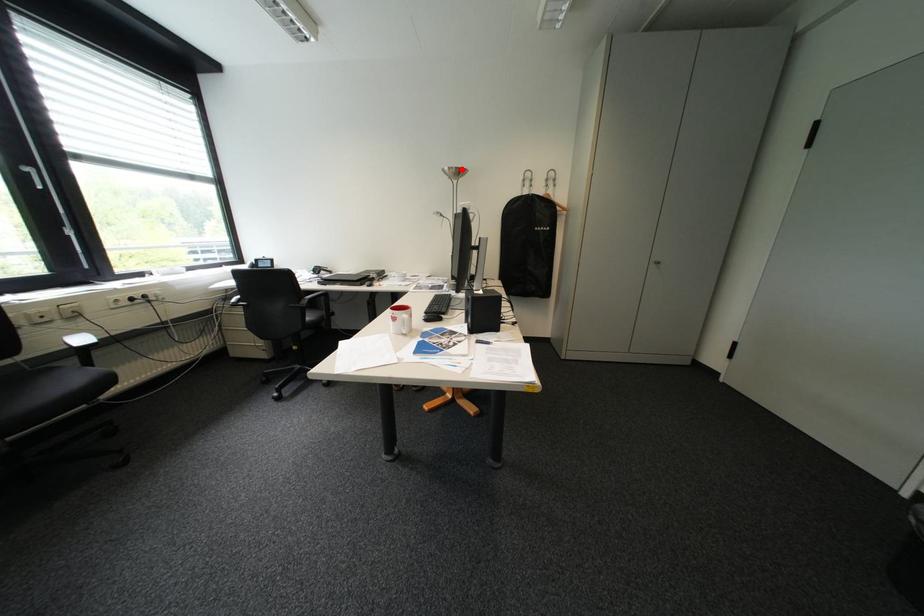
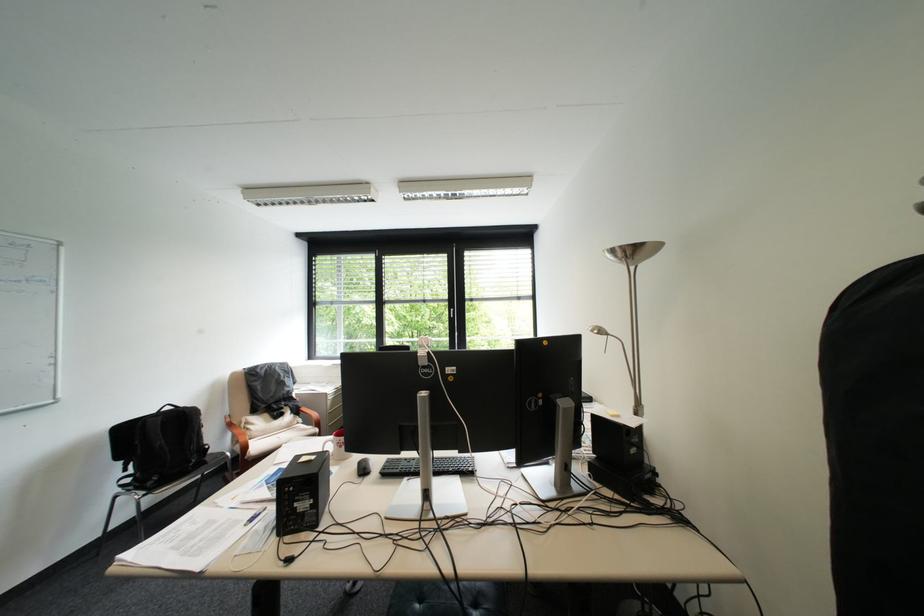
Question: I am providing you with two images of the same scene from different viewpoints. In image1, a red point is highlighted. Considering the same 3D point in image2, which of the following is correct?

Choices:
 (A) It is closer
 (B) It is farther

Answer: (B)